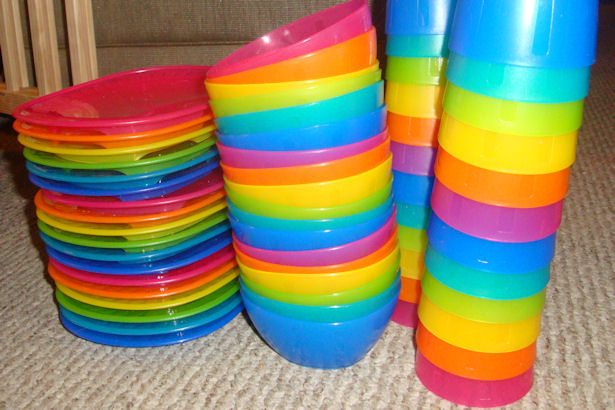
At what (x,y) coordinates should I click in order to perform the action: click on floor. Please return your answer as a coordinate pair (x, y). The image size is (615, 410). Looking at the image, I should click on (164, 390).